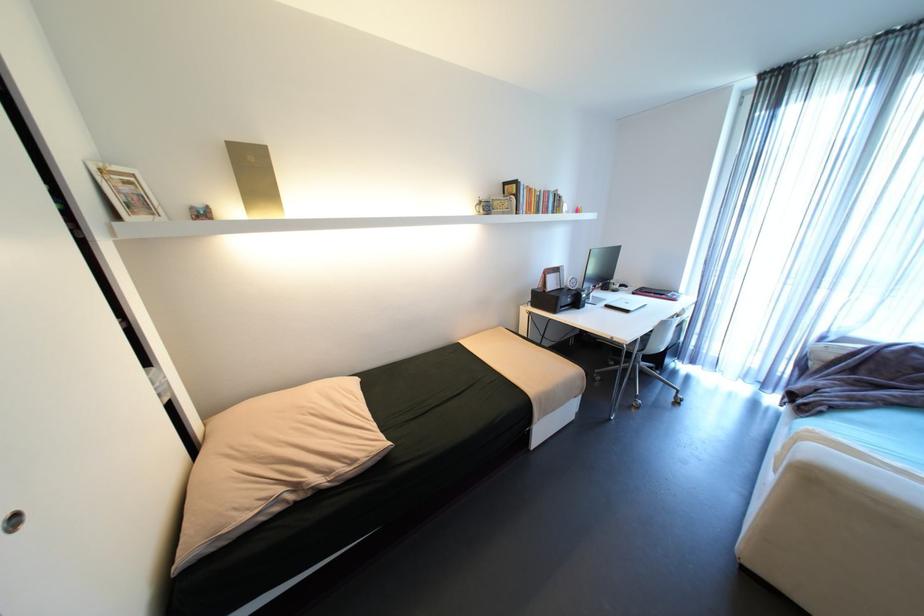
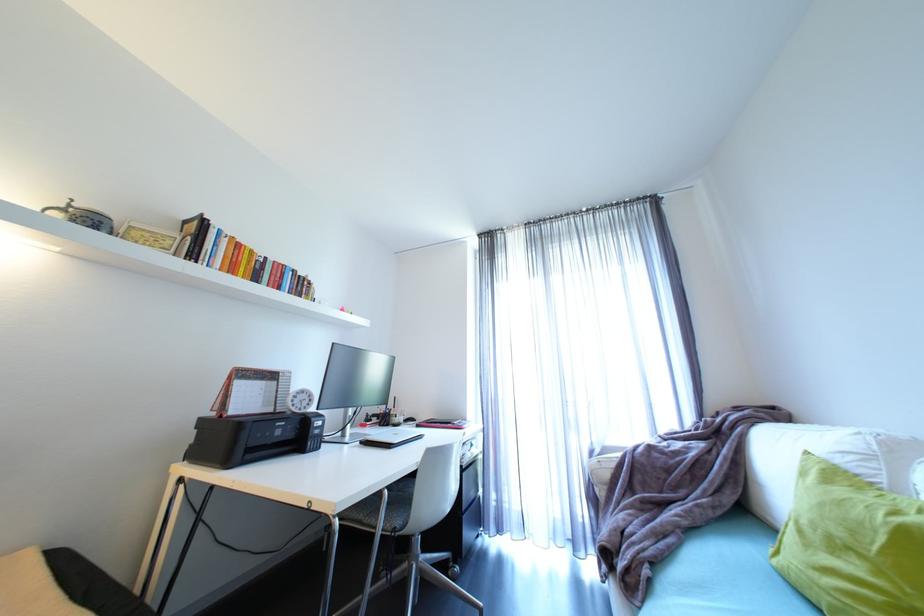
In the second image, find the point that corresponds to the point at 528,211 in the first image.

(208, 262)